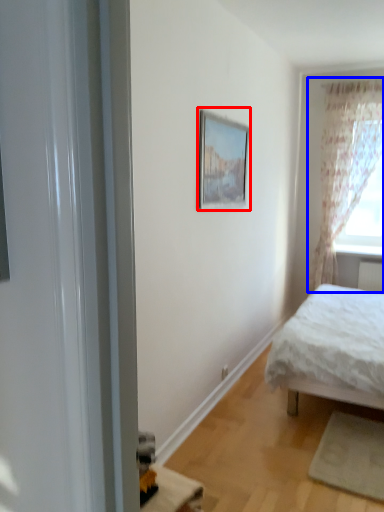
Question: Which of the following is the closest to the observer, picture frame (highlighted by a red box) or curtain (highlighted by a blue box)?

Choices:
 (A) picture frame
 (B) curtain

Answer: (A)